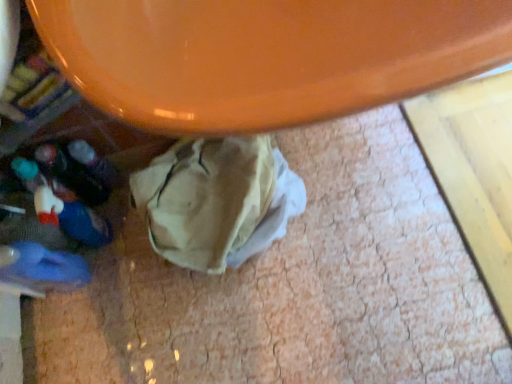
The height and width of the screenshot is (384, 512). What do you see at coordinates (42, 271) in the screenshot?
I see `blue rubber slipper at lower left` at bounding box center [42, 271].

Measure the distance between blue rubber slipper at lower left and camera.

33.20 inches.

Where is `blue rubber slipper at lower left`? Image resolution: width=512 pixels, height=384 pixels. blue rubber slipper at lower left is located at coordinates (42, 271).

What are the coordinates of `orange glossy table at upper center` in the screenshot? It's located at (265, 56).

What do you see at coordinates (265, 56) in the screenshot?
I see `orange glossy table at upper center` at bounding box center [265, 56].

Locate an element on the screen. blue rubber slipper at lower left is located at coordinates tap(42, 271).

Which object is positioned more to the left, blue rubber slipper at lower left or orange glossy table at upper center?

Positioned to the left is blue rubber slipper at lower left.

Does blue rubber slipper at lower left come in front of orange glossy table at upper center?

No, it is behind orange glossy table at upper center.

Considering the points (69, 284) and (292, 124), which point is behind, point (69, 284) or point (292, 124)?

The point (69, 284) is farther from the camera.

Looking at this image, from the image's perspective, between blue rubber slipper at lower left and orange glossy table at upper center, who is located below?

blue rubber slipper at lower left.

From a real-world perspective, between blue rubber slipper at lower left and orange glossy table at upper center, who is vertically lower?

In real-world perspective, blue rubber slipper at lower left is lower.

Is blue rubber slipper at lower left wider or thinner than orange glossy table at upper center?

Clearly, blue rubber slipper at lower left has less width compared to orange glossy table at upper center.

Is blue rubber slipper at lower left taller or shorter than orange glossy table at upper center?

Clearly, blue rubber slipper at lower left is taller compared to orange glossy table at upper center.

Can you confirm if blue rubber slipper at lower left is smaller than orange glossy table at upper center?

Yes, blue rubber slipper at lower left is smaller than orange glossy table at upper center.

Can we say blue rubber slipper at lower left lies outside orange glossy table at upper center?

blue rubber slipper at lower left is positioned outside orange glossy table at upper center.

Is blue rubber slipper at lower left far away from orange glossy table at upper center?

No, blue rubber slipper at lower left is not far from orange glossy table at upper center.

Is blue rubber slipper at lower left oriented towards orange glossy table at upper center?

No, blue rubber slipper at lower left is not facing towards orange glossy table at upper center.

Consider the image. Measure the distance between blue rubber slipper at lower left and orange glossy table at upper center.

They are 29.26 inches apart.

Where is `footwear below the orange glossy table at upper center (from a real-world perspective)`? The width and height of the screenshot is (512, 384). footwear below the orange glossy table at upper center (from a real-world perspective) is located at coordinates (42, 271).

Does orange glossy table at upper center appear on the right side of blue rubber slipper at lower left?

Indeed, orange glossy table at upper center is positioned on the right side of blue rubber slipper at lower left.

Which object is further away from the camera, orange glossy table at upper center or blue rubber slipper at lower left?

blue rubber slipper at lower left is behind.

Is point (236, 37) more distant than point (73, 274)?

No, (236, 37) is in front of (73, 274).

From the image's perspective, who appears lower, orange glossy table at upper center or blue rubber slipper at lower left?

blue rubber slipper at lower left.

From a real-world perspective, is orange glossy table at upper center on blue rubber slipper at lower left?

Yes.

Does orange glossy table at upper center have a greater width compared to blue rubber slipper at lower left?

Yes.

From their relative heights in the image, would you say orange glossy table at upper center is taller or shorter than blue rubber slipper at lower left?

Clearly, orange glossy table at upper center is shorter compared to blue rubber slipper at lower left.

Considering the sizes of objects orange glossy table at upper center and blue rubber slipper at lower left in the image provided, who is bigger, orange glossy table at upper center or blue rubber slipper at lower left?

orange glossy table at upper center.

Consider the image. Is orange glossy table at upper center inside or outside of blue rubber slipper at lower left?

orange glossy table at upper center is located beyond the bounds of blue rubber slipper at lower left.

Is orange glossy table at upper center touching blue rubber slipper at lower left?

No, orange glossy table at upper center is not touching blue rubber slipper at lower left.

Could you tell me if orange glossy table at upper center is turned towards blue rubber slipper at lower left?

No, orange glossy table at upper center is not turned towards blue rubber slipper at lower left.

Can you tell me how much orange glossy table at upper center and blue rubber slipper at lower left differ in facing direction?

3.22 degrees.

Where is `footwear that appears behind the orange glossy table at upper center`? This screenshot has height=384, width=512. footwear that appears behind the orange glossy table at upper center is located at coordinates (42, 271).

Find the location of a particular element. footwear that appears below the orange glossy table at upper center (from a real-world perspective) is located at coordinates (42, 271).

Locate an element on the screen. The image size is (512, 384). round table on the right of blue rubber slipper at lower left is located at coordinates (265, 56).